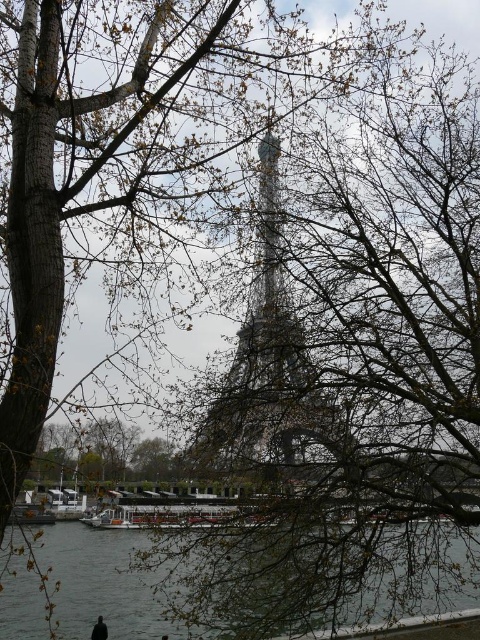
You are standing in a park and see the metallic silver eiffel tower at center and the gray water at lower center. Which object is higher in the image?

The metallic silver eiffel tower at center is above the gray water at lower center in the image.

You are standing in front of the Eiffel Tower and want to take a photo of the metallic silver eiffel tower at center. If your camera can focus on objects up to 30 feet away, will you be able to capture the tower clearly?

The metallic silver eiffel tower at center is 27.09 feet away from the camera, which is within the camera focus range of 30 feet. Therefore, the camera can capture the tower clearly.

Based on the photo, you are a photographer trying to capture the Eiffel Tower through the bare tree branches in the foreground. Based on the scene, will the gray water at lower center be visible behind the metallic silver eiffel tower at center in your photo?

The gray water at lower center is behind the metallic silver eiffel tower at center, so it will be visible behind the tower in the photo.